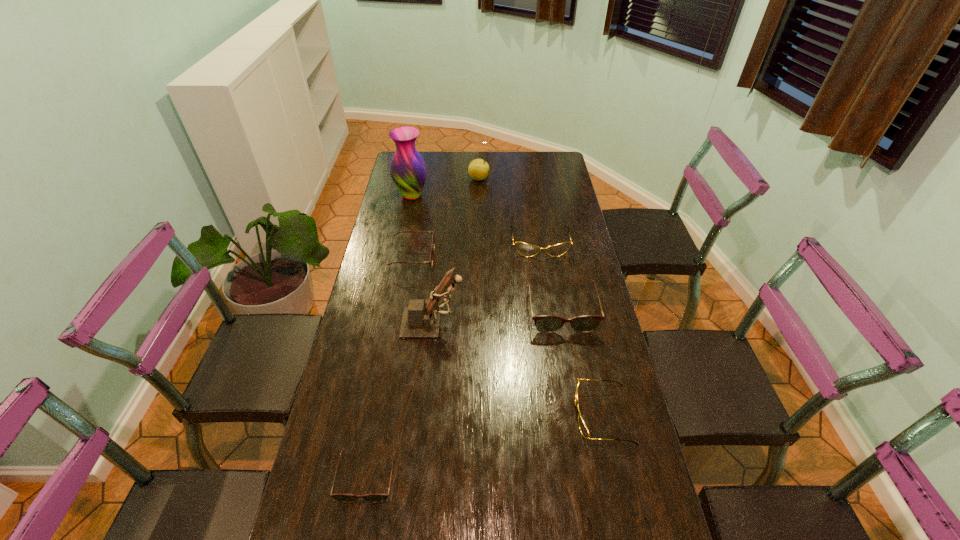
You are a GUI agent. You are given a task and a screenshot of the screen. Output one action in this format:
    pyautogui.click(x=<x>, y=<y>)
    Task: Click on the spectacles that stands as the second closest to the biggest brown spectacles
    Image resolution: width=960 pixels, height=540 pixels.
    Given the screenshot: What is the action you would take?
    pyautogui.click(x=584, y=430)

Find the location of a particular element. The width and height of the screenshot is (960, 540). the closest brown spectacles to the third nearest object is located at coordinates coord(544,323).

Where is `brown spectacles that is the second closest to the second nearest spectacles`? The image size is (960, 540). brown spectacles that is the second closest to the second nearest spectacles is located at coordinates (433, 241).

Choose which gold spectacles is the second nearest neighbor to the figurine. Please provide its 2D coordinates. Your answer should be formatted as a tuple, i.e. [(x, y)], where the tuple contains the x and y coordinates of a point satisfying the conditions above.

[(584, 430)]

Select which gold spectacles appears as the closest to the biggest gold spectacles. Please provide its 2D coordinates. Your answer should be formatted as a tuple, i.e. [(x, y)], where the tuple contains the x and y coordinates of a point satisfying the conditions above.

[(584, 430)]

What are the coordinates of `free point that satisfies the following two spatial constraints: 1. on the front-facing side of the eighth shortest object; 2. at the front view of the fifth farthest spectacles` in the screenshot? It's located at (418, 477).

At what (x,y) coordinates should I click in order to perform the action: click on free space that satisfies the following two spatial constraints: 1. at the front view of the farthest brown spectacles; 2. at the front view of the fifth farthest spectacles. Please return your answer as a coordinate pair (x, y). Looking at the image, I should click on 376,477.

This screenshot has width=960, height=540. In order to click on free region that satisfies the following two spatial constraints: 1. on the logo side of the farthest object; 2. at the front view of the eighth farthest object in this screenshot , I will do `click(478, 477)`.